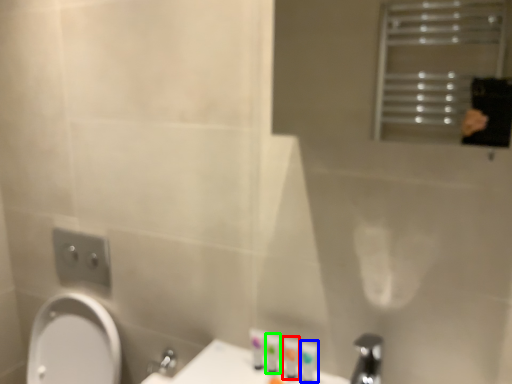
Question: Which object is positioned farthest from toiletry (highlighted by a red box)? Select from toiletry (highlighted by a blue box) and toiletry (highlighted by a green box).

Choices:
 (A) toiletry
 (B) toiletry

Answer: (B)